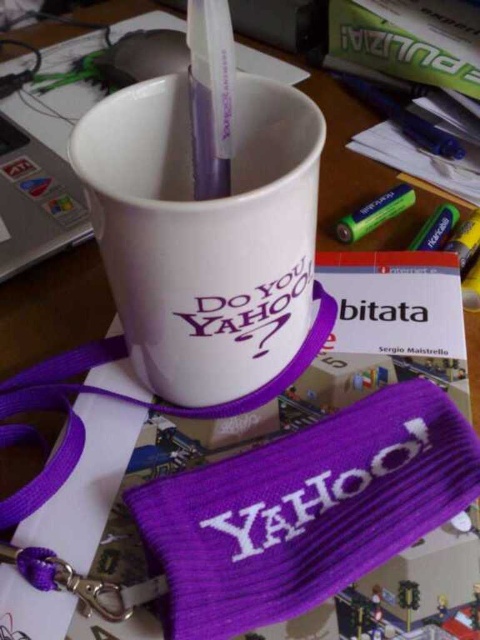
Who is positioned more to the right, white ceramic mug at center or green matte crayon at upper right?

green matte crayon at upper right

Is point (80, 147) in front of point (357, 212)?

Yes.

Is point (98, 122) farther from viewer compared to point (399, 212)?

That is False.

Locate an element on the screen. The width and height of the screenshot is (480, 640). white ceramic mug at center is located at coordinates tap(204, 234).

Who is more forward, (199,170) or (375,209)?

Point (199,170) is more forward.

Is white plastic pencil at upper center smaller than green matte crayon at upper right?

No, white plastic pencil at upper center is not smaller than green matte crayon at upper right.

Identify the location of white plastic pencil at upper center. This screenshot has height=640, width=480. (211, 96).

Consider the image. Between white ceramic mug at center and green matte crayon at lower right, which one appears on the left side from the viewer's perspective?

white ceramic mug at center

This screenshot has width=480, height=640. I want to click on white ceramic mug at center, so click(x=204, y=234).

Describe the element at coordinates (204, 234) in the screenshot. I see `white ceramic mug at center` at that location.

Find the location of a particular element. The width and height of the screenshot is (480, 640). white ceramic mug at center is located at coordinates (204, 234).